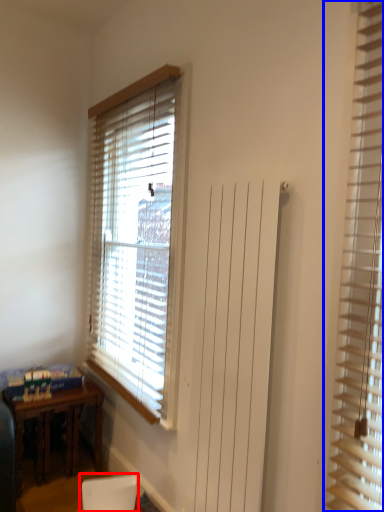
Question: Which point is further to the camera, armchair (highlighted by a red box) or window blind (highlighted by a blue box)?

Choices:
 (A) armchair
 (B) window blind

Answer: (A)